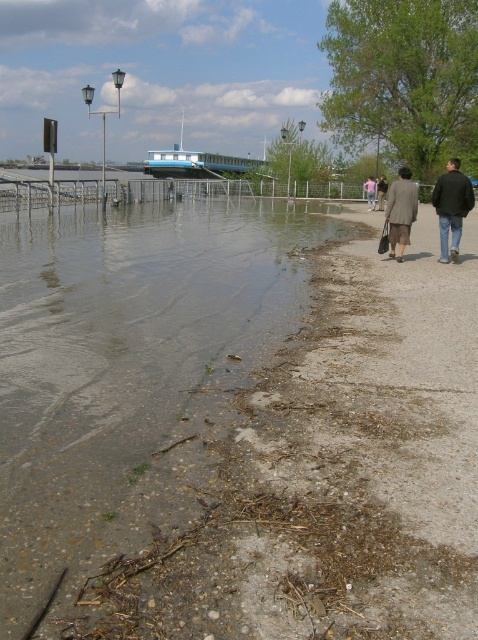
Can you confirm if brown dirt at lower left is taller than dark blue jacket at right?

Incorrect, brown dirt at lower left's height is not larger of dark blue jacket at right's.

Who is lower down, brown dirt at lower left or dark blue jacket at right?

brown dirt at lower left is lower down.

This screenshot has height=640, width=478. Describe the element at coordinates (129, 371) in the screenshot. I see `brown dirt at lower left` at that location.

What are the coordinates of `brown dirt at lower left` in the screenshot? It's located at (129, 371).

Can you confirm if dark blue jacket at right is positioned below pink fabric couple at center?

Yes.

Can you confirm if dark blue jacket at right is positioned to the right of pink fabric couple at center?

Indeed, dark blue jacket at right is positioned on the right side of pink fabric couple at center.

Where is `dark blue jacket at right`? This screenshot has height=640, width=478. dark blue jacket at right is located at coordinates (452, 208).

Which is more to the right, brown dirt at lower left or matte gray coat at center?

matte gray coat at center

Who is more forward, (12, 282) or (400, 250)?

Positioned in front is point (12, 282).

Find the location of a particular element. brown dirt at lower left is located at coordinates (129, 371).